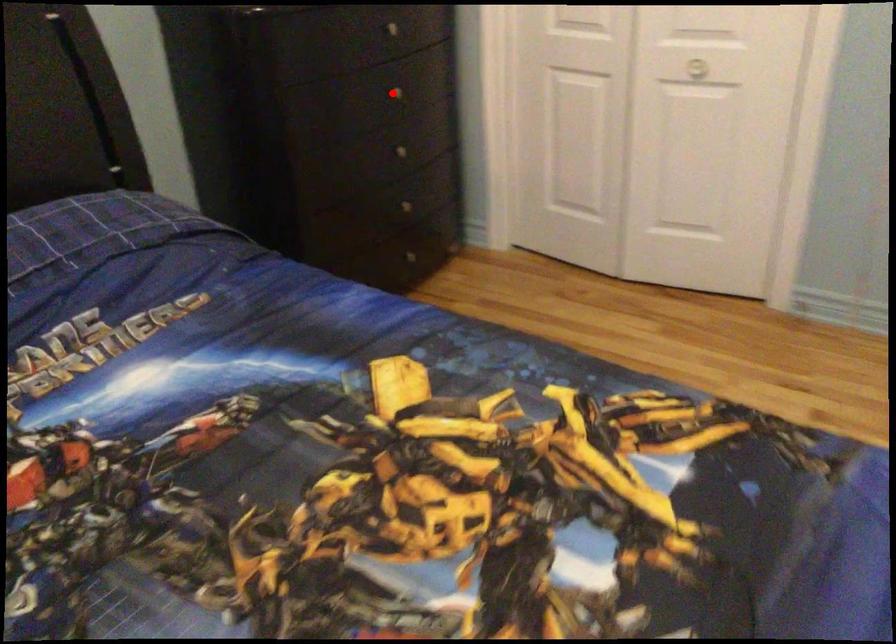
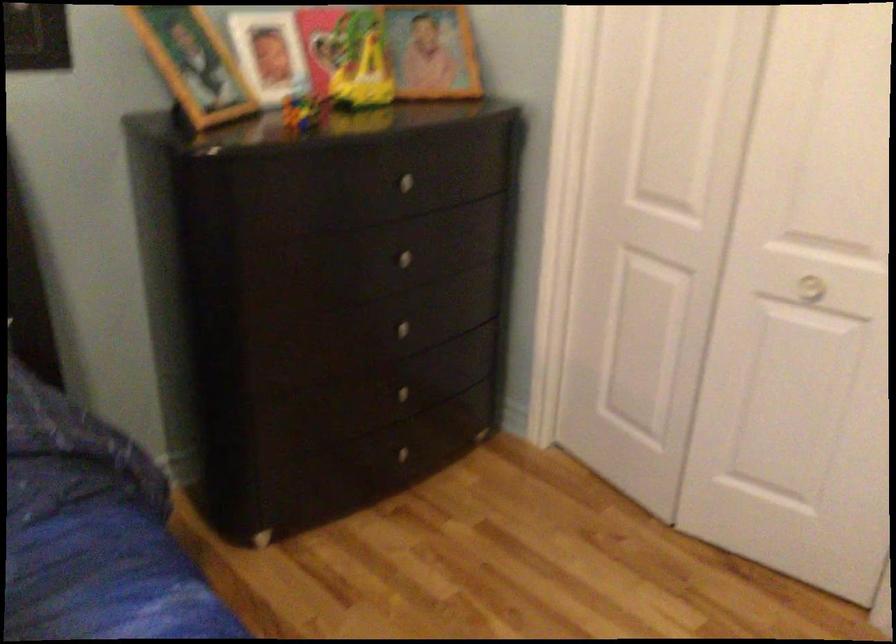
Question: I am providing you with two images of the same scene from different viewpoints. Given a red point in image1, look at the same physical point in image2. Is it:

Choices:
 (A) Closer to the viewpoint
 (B) Farther from the viewpoint

Answer: (A)